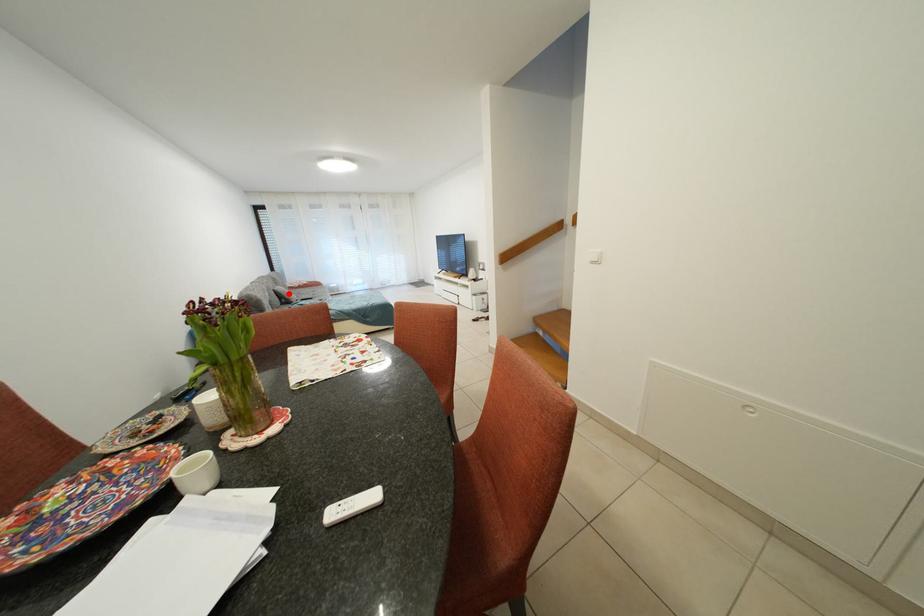
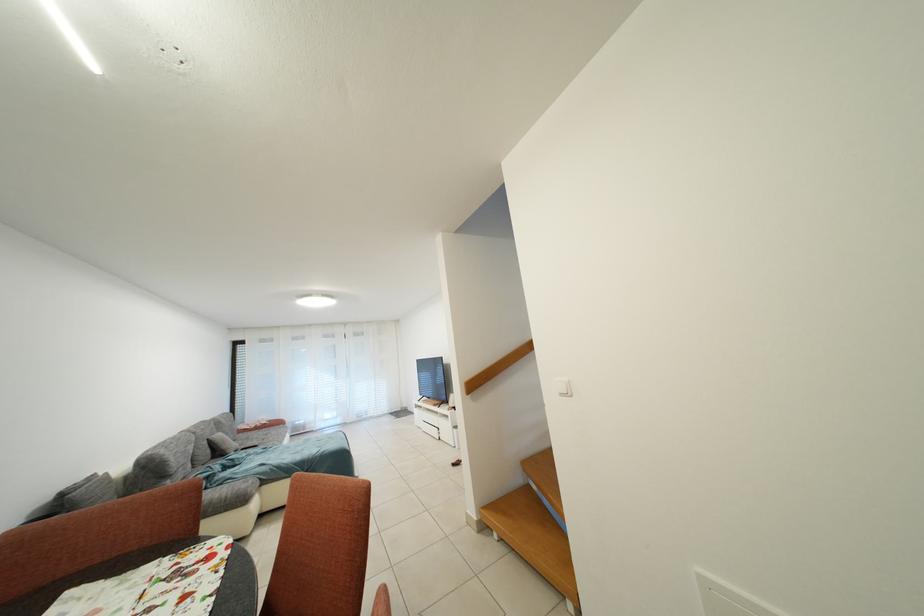
In the second image, find the point that corresponds to the highlighted location in the first image.

(227, 440)